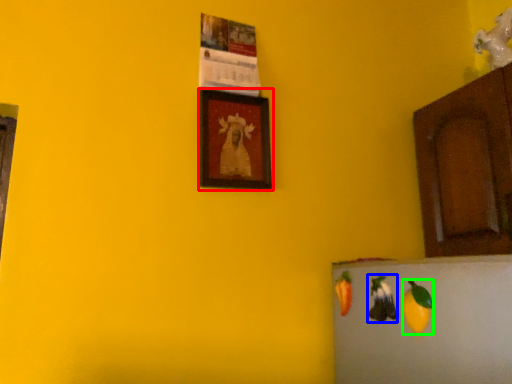
Question: Estimate the real-world distances between objects in this image. Which object is closer to picture frame (highlighted by a red box), fruit (highlighted by a blue box) or fruit (highlighted by a green box)?

Choices:
 (A) fruit
 (B) fruit

Answer: (A)